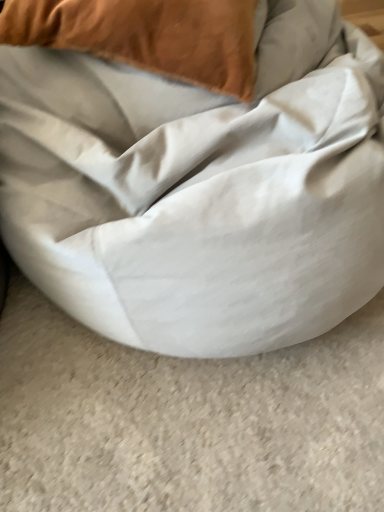
The height and width of the screenshot is (512, 384). Describe the element at coordinates (147, 36) in the screenshot. I see `velvet orange pillow at upper left` at that location.

What are the coordinates of `velvet orange pillow at upper left` in the screenshot? It's located at (147, 36).

The height and width of the screenshot is (512, 384). What do you see at coordinates (201, 189) in the screenshot? I see `white fabric bean bag at center` at bounding box center [201, 189].

Measure the distance between point (204, 116) and camera.

The depth of point (204, 116) is 29.41 inches.

Find the location of `white fabric bean bag at center`. white fabric bean bag at center is located at coordinates (201, 189).

Locate an element on the screen. The image size is (384, 512). velvet orange pillow at upper left is located at coordinates (147, 36).

Is white fabric bean bag at center to the left or to the right of velvet orange pillow at upper left in the image?

Based on their positions, white fabric bean bag at center is located to the right of velvet orange pillow at upper left.

In the image, is white fabric bean bag at center positioned in front of or behind velvet orange pillow at upper left?

In the image, white fabric bean bag at center appears in front of velvet orange pillow at upper left.

Is point (157, 252) farther from viewer compared to point (34, 42)?

That is False.

From the image's perspective, which one is positioned lower, white fabric bean bag at center or velvet orange pillow at upper left?

white fabric bean bag at center is shown below in the image.

Consider the image. From a real-world perspective, between white fabric bean bag at center and velvet orange pillow at upper left, who is vertically higher?

velvet orange pillow at upper left, from a real-world perspective.

Can you confirm if white fabric bean bag at center is wider than velvet orange pillow at upper left?

Yes.

Can you confirm if white fabric bean bag at center is shorter than velvet orange pillow at upper left?

Incorrect, the height of white fabric bean bag at center does not fall short of that of velvet orange pillow at upper left.

Who is bigger, white fabric bean bag at center or velvet orange pillow at upper left?

With larger size is white fabric bean bag at center.

Is velvet orange pillow at upper left surrounded by white fabric bean bag at center?

Yes, velvet orange pillow at upper left is surrounded by white fabric bean bag at center.

Is white fabric bean bag at center touching velvet orange pillow at upper left?

white fabric bean bag at center and velvet orange pillow at upper left are clearly separated.

Looking at this image, is white fabric bean bag at center oriented away from velvet orange pillow at upper left?

Yes, white fabric bean bag at center is positioned with its back facing velvet orange pillow at upper left.

Measure the distance between white fabric bean bag at center and velvet orange pillow at upper left.

The distance of white fabric bean bag at center from velvet orange pillow at upper left is 7.64 inches.

Find the location of a particular element. Image resolution: width=384 pixels, height=512 pixels. pillow on the left of white fabric bean bag at center is located at coordinates (147, 36).

Visually, is velvet orange pillow at upper left positioned to the left or to the right of white fabric bean bag at center?

In the image, velvet orange pillow at upper left appears on the left side of white fabric bean bag at center.

Is velvet orange pillow at upper left positioned in front of white fabric bean bag at center?

No, velvet orange pillow at upper left is behind white fabric bean bag at center.

Does point (186, 34) come behind point (73, 82)?

No, (186, 34) is closer to viewer.

From the image's perspective, relative to white fabric bean bag at center, is velvet orange pillow at upper left above or below?

Based on their image positions, velvet orange pillow at upper left is located above white fabric bean bag at center.

From a real-world perspective, who is located lower, velvet orange pillow at upper left or white fabric bean bag at center?

From a 3D spatial view, white fabric bean bag at center is below.

Looking at this image, which of these two, velvet orange pillow at upper left or white fabric bean bag at center, is thinner?

velvet orange pillow at upper left is thinner.

Who is shorter, velvet orange pillow at upper left or white fabric bean bag at center?

velvet orange pillow at upper left.

Based on their sizes in the image, would you say velvet orange pillow at upper left is bigger or smaller than white fabric bean bag at center?

In the image, velvet orange pillow at upper left appears to be smaller than white fabric bean bag at center.

Would you say velvet orange pillow at upper left contains white fabric bean bag at center?

No.

Are velvet orange pillow at upper left and white fabric bean bag at center far apart?

No.

Is velvet orange pillow at upper left positioned with its back to white fabric bean bag at center?

Yes, velvet orange pillow at upper left's orientation is away from white fabric bean bag at center.

In the scene shown: How many degrees apart are the facing directions of velvet orange pillow at upper left and white fabric bean bag at center?

The angle between the facing direction of velvet orange pillow at upper left and the facing direction of white fabric bean bag at center is 28.8 degrees.

In the image, there is a velvet orange pillow at upper left. In order to click on furniture below it (from the image's perspective) in this screenshot , I will do `click(201, 189)`.

What are the coordinates of `furniture lying on the right of velvet orange pillow at upper left` in the screenshot? It's located at (201, 189).

The width and height of the screenshot is (384, 512). I want to click on furniture in front of the velvet orange pillow at upper left, so click(201, 189).